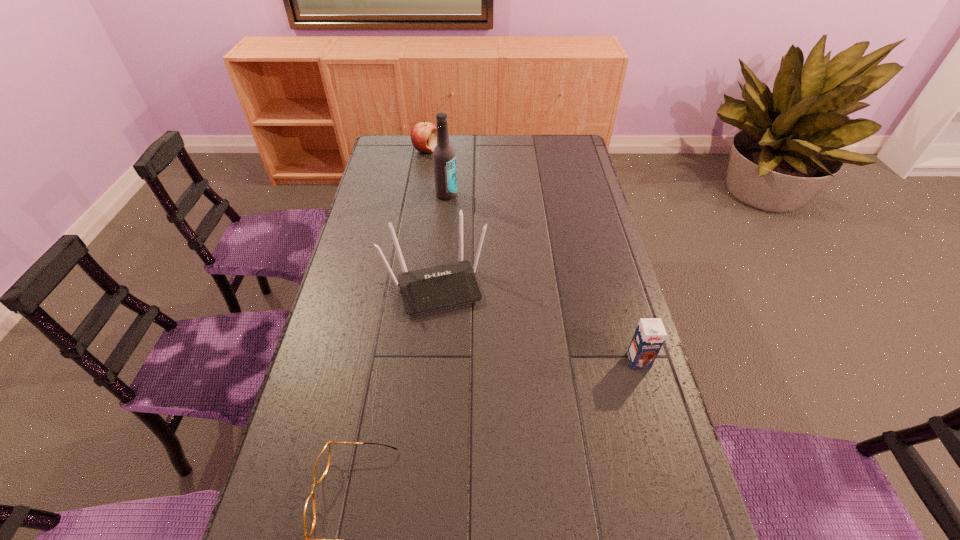
This screenshot has height=540, width=960. Identify the location of router at the left edge. (438, 287).

Where is `object that is at the right edge`? Image resolution: width=960 pixels, height=540 pixels. object that is at the right edge is located at coordinates (650, 333).

Identify the location of object that is at the far left corner. The image size is (960, 540). (423, 135).

In the image, there is a desktop. Find the location of `vacant space at the far edge`. vacant space at the far edge is located at coordinates (544, 160).

Locate an element on the screen. The height and width of the screenshot is (540, 960). free location at the left edge of the desktop is located at coordinates (365, 366).

Find the location of `free space at the right edge of the desktop`. free space at the right edge of the desktop is located at coordinates (585, 196).

In order to click on vacant space at the near right corner of the desktop in this screenshot , I will do `click(657, 534)`.

Image resolution: width=960 pixels, height=540 pixels. I want to click on empty space that is in between the fourth farthest object and the fourth tallest object, so click(x=532, y=255).

You are a GUI agent. You are given a task and a screenshot of the screen. Output one action in this format:
    pyautogui.click(x=<x>, y=<y>)
    Task: Click on the free spot between the third tallest object and the apple
    This screenshot has width=960, height=540.
    Given the screenshot: What is the action you would take?
    pyautogui.click(x=532, y=255)

Locate an element on the screen. The height and width of the screenshot is (540, 960). vacant space that is in between the second nearest object and the farthest object is located at coordinates (532, 255).